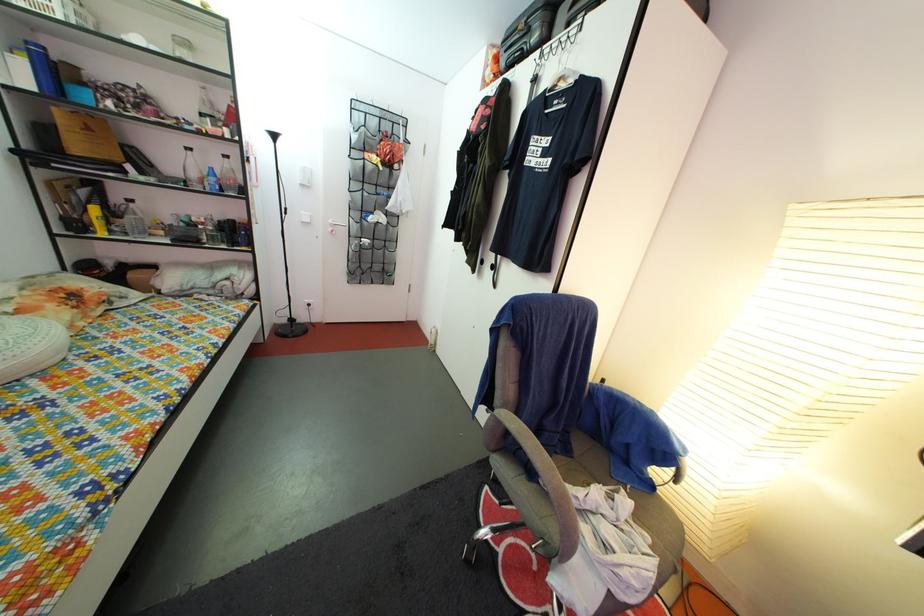
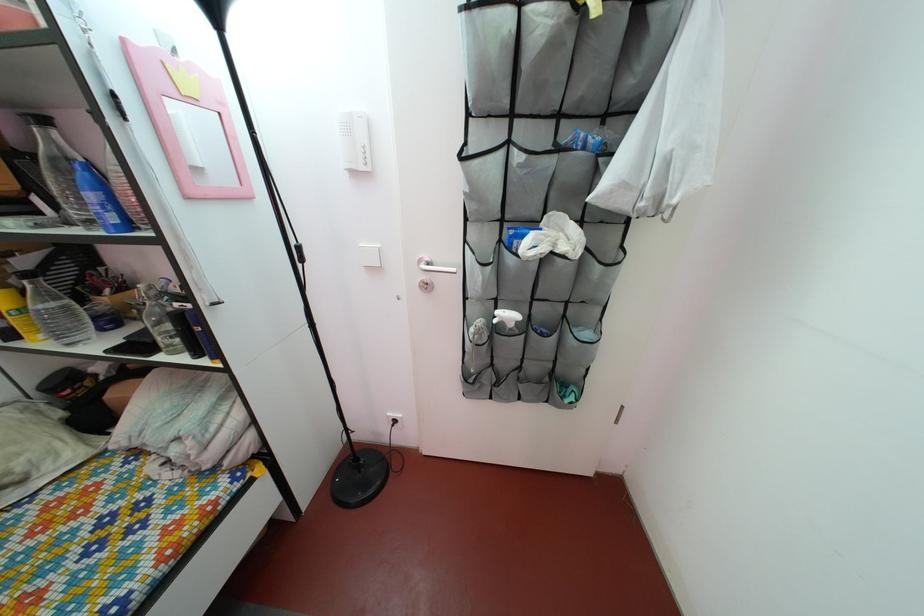
Question: I am providing you with two images of the same scene from different viewpoints. After the viewpoint changes to image2, which objects are now occluded?

Choices:
 (A) clear ridged bottle
 (B) silver metal can
 (C) silver door handle
 (D) clear plastic bottle

Answer: (D)